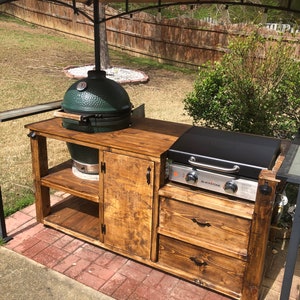
Identify the location of cabinet. The image size is (300, 300). (162, 141).